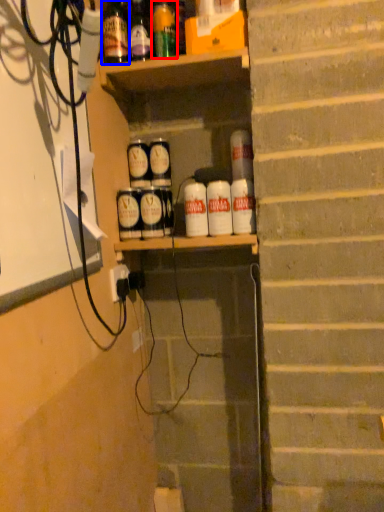
Question: Among these objects, which one is nearest to the camera, bottle (highlighted by a red box) or bottle (highlighted by a blue box)?

Choices:
 (A) bottle
 (B) bottle

Answer: (B)